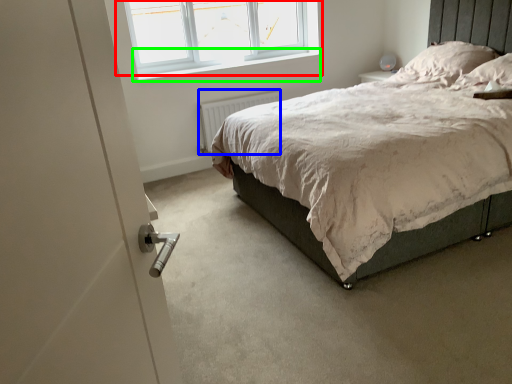
Question: Based on their relative distances, which object is farther from window (highlighted by a red box)? Choose from radiator (highlighted by a blue box) and window sill (highlighted by a green box).

Choices:
 (A) radiator
 (B) window sill

Answer: (A)